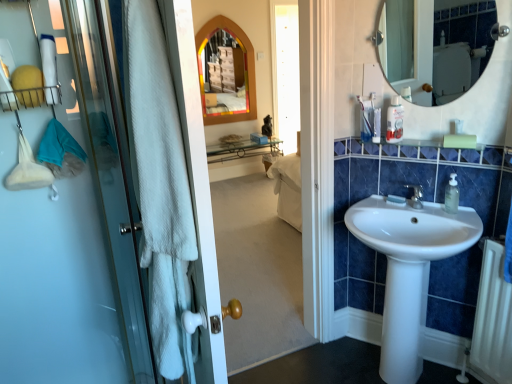
Question: From a real-world perspective, is white matte soap at sink right below white glossy sink at center?

Choices:
 (A) no
 (B) yes

Answer: (A)

Question: Does white matte soap at sink right touch white glossy sink at center?

Choices:
 (A) yes
 (B) no

Answer: (B)

Question: From the image's perspective, is white matte soap at sink right over white glossy sink at center?

Choices:
 (A) yes
 (B) no

Answer: (A)

Question: Is white matte soap at sink right bigger than white glossy sink at center?

Choices:
 (A) no
 (B) yes

Answer: (A)

Question: Is white matte soap at sink right further to camera compared to white glossy sink at center?

Choices:
 (A) no
 (B) yes

Answer: (B)

Question: Based on their sizes in the image, would you say clear plastic bottle at upper right is bigger or smaller than white matte soap at sink right?

Choices:
 (A) big
 (B) small

Answer: (A)

Question: Is point (454, 185) closer or farther from the camera than point (404, 203)?

Choices:
 (A) farther
 (B) closer

Answer: (B)

Question: In the image, is clear plastic bottle at upper right positioned in front of or behind white matte soap at sink right?

Choices:
 (A) behind
 (B) front

Answer: (B)

Question: From a real-world perspective, is clear plastic bottle at upper right above or below white matte soap at sink right?

Choices:
 (A) below
 (B) above

Answer: (B)

Question: Which is correct: clear plastic bottle at upper right is inside white textured towel at left, or outside of it?

Choices:
 (A) outside
 (B) inside

Answer: (A)

Question: In terms of width, does clear plastic bottle at upper right look wider or thinner when compared to white textured towel at left?

Choices:
 (A) wide
 (B) thin

Answer: (B)

Question: Is point (397, 140) closer or farther from the camera than point (73, 124)?

Choices:
 (A) closer
 (B) farther

Answer: (B)

Question: Is clear plastic bottle at upper right in front of or behind white textured towel at left in the image?

Choices:
 (A) front
 (B) behind

Answer: (B)

Question: Based on their sizes in the image, would you say white glossy mirror at upper right is bigger or smaller than white glossy sink at center?

Choices:
 (A) big
 (B) small

Answer: (B)

Question: Considering the positions of white glossy mirror at upper right and white glossy sink at center in the image, is white glossy mirror at upper right wider or thinner than white glossy sink at center?

Choices:
 (A) thin
 (B) wide

Answer: (A)